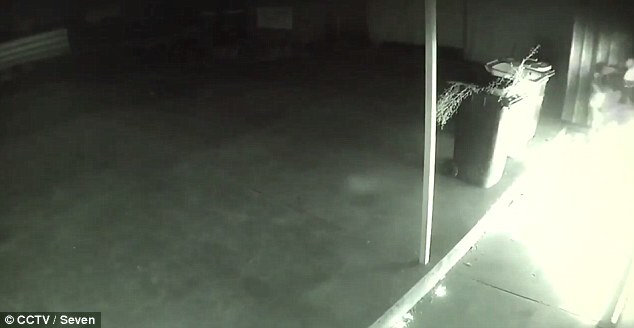
Image resolution: width=634 pixels, height=328 pixels. I want to click on wall, so click(510, 18).